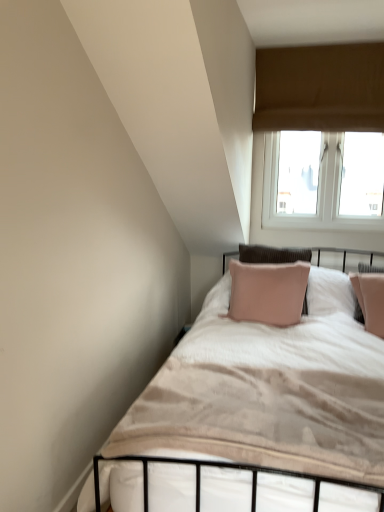
Question: Do you think velvet beige bed at center is within brown fabric window at upper right, or outside of it?

Choices:
 (A) outside
 (B) inside

Answer: (A)

Question: Is velvet beige bed at center bigger or smaller than brown fabric window at upper right?

Choices:
 (A) big
 (B) small

Answer: (B)

Question: Considering the positions of point (329, 360) and point (362, 123), is point (329, 360) closer or farther from the camera than point (362, 123)?

Choices:
 (A) closer
 (B) farther

Answer: (A)

Question: From the image's perspective, is brown fabric window at upper right positioned above or below velvet beige bed at center?

Choices:
 (A) above
 (B) below

Answer: (A)

Question: Is brown fabric window at upper right inside or outside of velvet beige bed at center?

Choices:
 (A) inside
 (B) outside

Answer: (B)

Question: From their relative heights in the image, would you say brown fabric window at upper right is taller or shorter than velvet beige bed at center?

Choices:
 (A) short
 (B) tall

Answer: (B)

Question: In terms of width, does brown fabric window at upper right look wider or thinner when compared to velvet beige bed at center?

Choices:
 (A) wide
 (B) thin

Answer: (B)